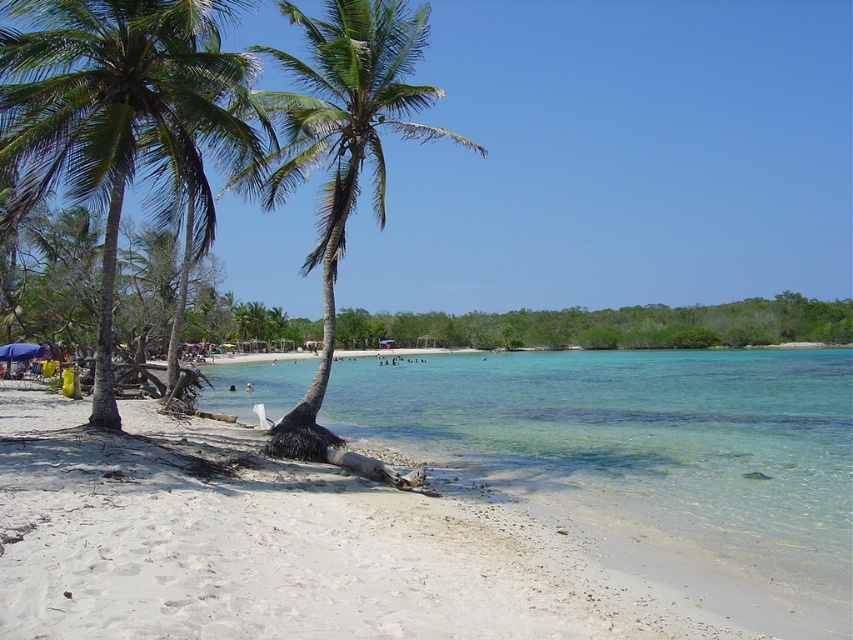
Which of these two, white sandy beach at lower left or green leafy palm tree at left, stands shorter?

white sandy beach at lower left

Find the location of a particular element. white sandy beach at lower left is located at coordinates (277, 545).

Where is `white sandy beach at lower left`? white sandy beach at lower left is located at coordinates (277, 545).

Does green leafy palm tree at left have a lesser width compared to green leafy palm tree at center?

Incorrect, green leafy palm tree at left's width is not less than green leafy palm tree at center's.

Can you confirm if green leafy palm tree at left is positioned above green leafy palm tree at center?

Actually, green leafy palm tree at left is below green leafy palm tree at center.

Locate an element on the screen. green leafy palm tree at left is located at coordinates (120, 118).

Who is positioned more to the right, white sandy beach at lower left or green leafy palm tree at center?

From the viewer's perspective, green leafy palm tree at center appears more on the right side.

This screenshot has width=853, height=640. What do you see at coordinates (277, 545) in the screenshot?
I see `white sandy beach at lower left` at bounding box center [277, 545].

The image size is (853, 640). Find the location of `white sandy beach at lower left`. white sandy beach at lower left is located at coordinates (277, 545).